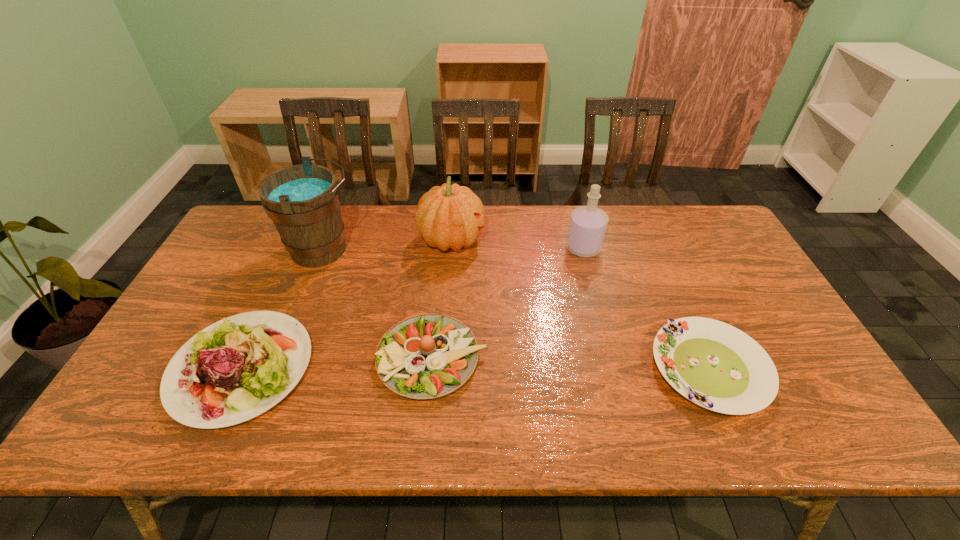
Where is `wine bucket`? The image size is (960, 540). wine bucket is located at coordinates (303, 201).

Image resolution: width=960 pixels, height=540 pixels. I want to click on the second object from right to left, so click(588, 224).

The image size is (960, 540). I want to click on pumpkin, so click(451, 216).

I want to click on the second salad plate from left to right, so click(427, 356).

Locate an element on the screen. The height and width of the screenshot is (540, 960). the leftmost salad plate is located at coordinates (261, 355).

This screenshot has height=540, width=960. In order to click on the rightmost salad plate in this screenshot , I will do `click(711, 363)`.

Locate an element on the screen. The height and width of the screenshot is (540, 960). the rightmost object is located at coordinates (711, 363).

Image resolution: width=960 pixels, height=540 pixels. Identify the location of vacant area located 0.070m with a handle on the side of the wine bucket. [384, 250].

Locate an element on the screen. vacant space located on the left of the second object from right to left is located at coordinates (481, 248).

Identify the location of vacant space located on the carved face of the pumpkin. (561, 240).